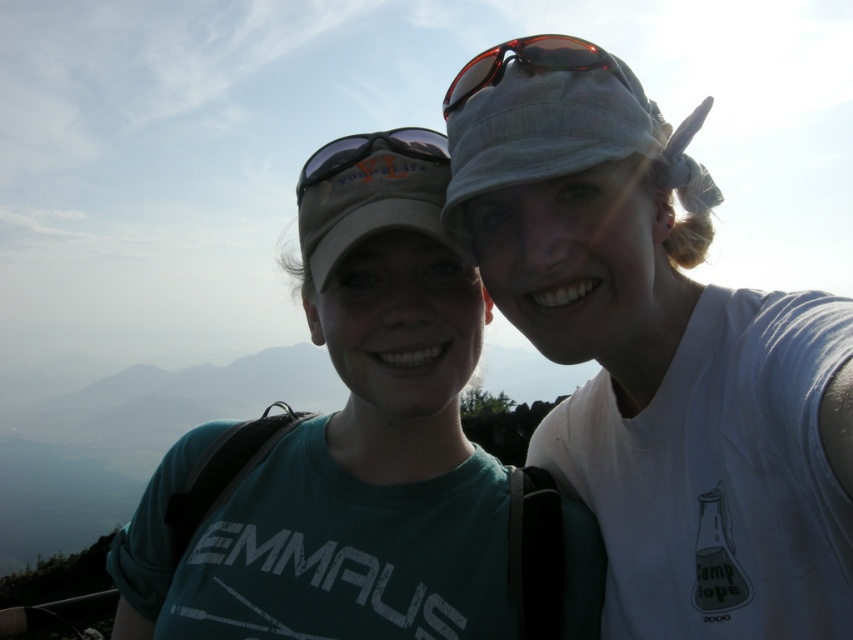
You are a photographer trying to capture a closeup of the shiny red sunglasses at center and the matte gray goggles at center. Since the camera can only focus on one object at a time, which object should you focus on first to ensure it appears sharp in the photo?

The shiny red sunglasses at center is much taller than the matte gray goggles at center, so you should focus on the shiny red sunglasses at center first since it is larger and more prominent in the frame.

You are a photographer trying to capture the exact position of the matte gray baseball cap at upper center in the image. What are the coordinates of this object?

The coordinates of the matte gray baseball cap at upper center are at point (369, 193).